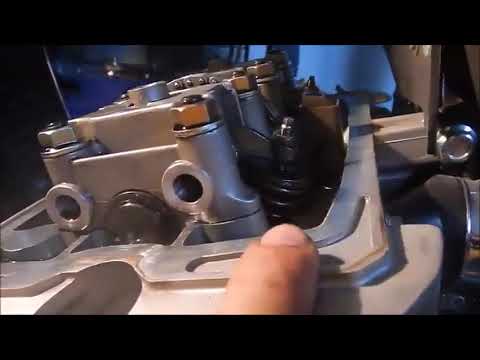
This screenshot has height=360, width=480. Find the location of `washers`. washers is located at coordinates (203, 129), (59, 153), (248, 93), (270, 79), (284, 65).